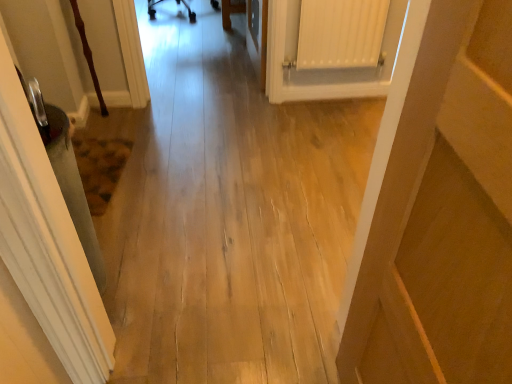
Question: Considering the relative sizes of wooden door at right and light wood floor at center in the image provided, is wooden door at right bigger than light wood floor at center?

Choices:
 (A) no
 (B) yes

Answer: (A)

Question: Is the depth of wooden door at right less than that of light wood floor at center?

Choices:
 (A) no
 (B) yes

Answer: (B)

Question: Considering the relative positions of wooden door at right and light wood floor at center in the image provided, is wooden door at right to the right of light wood floor at center from the viewer's perspective?

Choices:
 (A) yes
 (B) no

Answer: (A)

Question: Is wooden door at right taller than light wood floor at center?

Choices:
 (A) no
 (B) yes

Answer: (B)

Question: Is wooden door at right touching light wood floor at center?

Choices:
 (A) no
 (B) yes

Answer: (A)

Question: From the image's perspective, relative to light wood floor at center, is wooden door at right above or below?

Choices:
 (A) above
 (B) below

Answer: (B)

Question: Visually, is wooden door at right positioned to the left or to the right of light wood floor at center?

Choices:
 (A) right
 (B) left

Answer: (A)

Question: Looking at the image, does wooden door at right seem bigger or smaller compared to light wood floor at center?

Choices:
 (A) small
 (B) big

Answer: (A)

Question: Considering the positions of wooden door at right and light wood floor at center in the image, is wooden door at right taller or shorter than light wood floor at center?

Choices:
 (A) short
 (B) tall

Answer: (B)

Question: Is white matte radiator at upper right inside or outside of light wood floor at center?

Choices:
 (A) inside
 (B) outside

Answer: (B)

Question: From a real-world perspective, relative to light wood floor at center, is white matte radiator at upper right vertically above or below?

Choices:
 (A) above
 (B) below

Answer: (B)

Question: In terms of height, does white matte radiator at upper right look taller or shorter compared to light wood floor at center?

Choices:
 (A) tall
 (B) short

Answer: (B)

Question: From the image's perspective, is white matte radiator at upper right located above or below light wood floor at center?

Choices:
 (A) above
 (B) below

Answer: (A)

Question: Based on their sizes in the image, would you say light wood floor at center is bigger or smaller than white matte radiator at upper right?

Choices:
 (A) big
 (B) small

Answer: (A)

Question: From a real-world perspective, is light wood floor at center physically located above or below white matte radiator at upper right?

Choices:
 (A) below
 (B) above

Answer: (B)